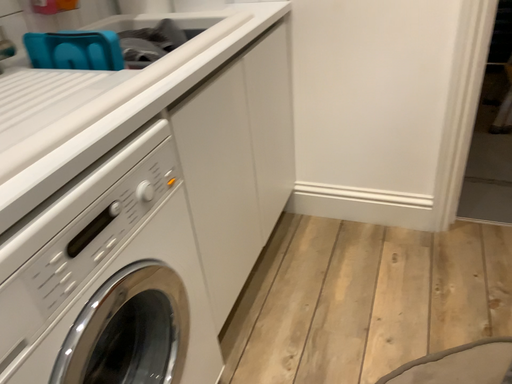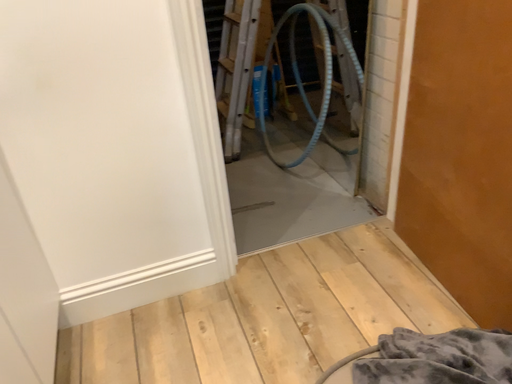
Question: How did the camera likely rotate when shooting the video?

Choices:
 (A) rotated downward
 (B) rotated upward

Answer: (B)